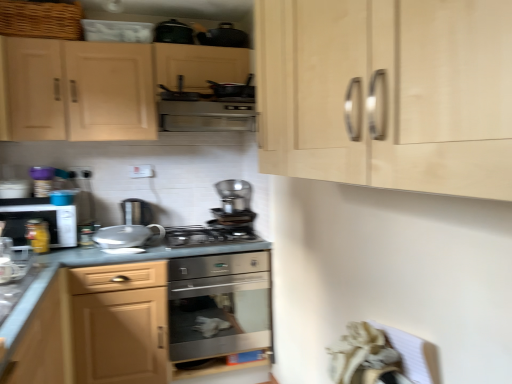
In order to click on free point to the right of yellow glass jar at left, positioned as the 2th appliance in bottom-to-top order in this screenshot , I will do `click(66, 250)`.